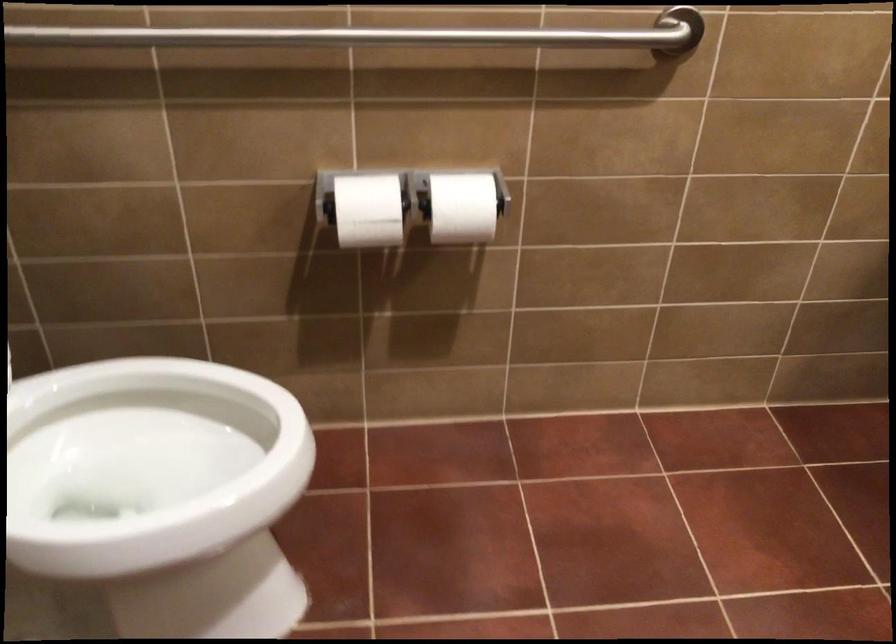
This screenshot has height=644, width=896. Identify the location of white toilet seat. (147, 464).